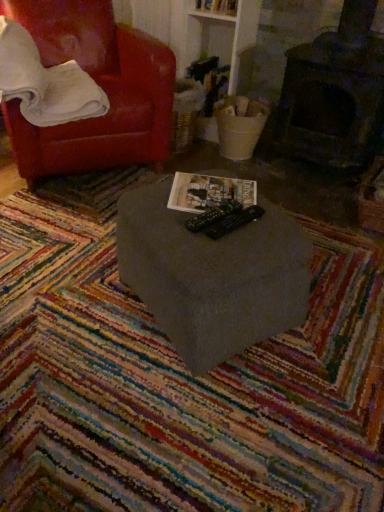
Where is `vacant space situated above matte gray table at center (from a real-world perspective)`? The height and width of the screenshot is (512, 384). vacant space situated above matte gray table at center (from a real-world perspective) is located at coordinates (195, 198).